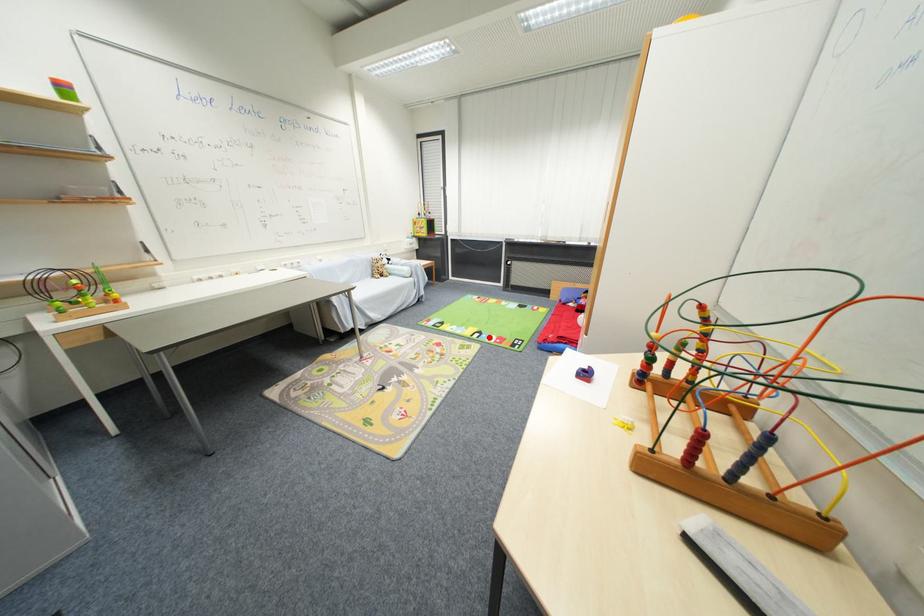
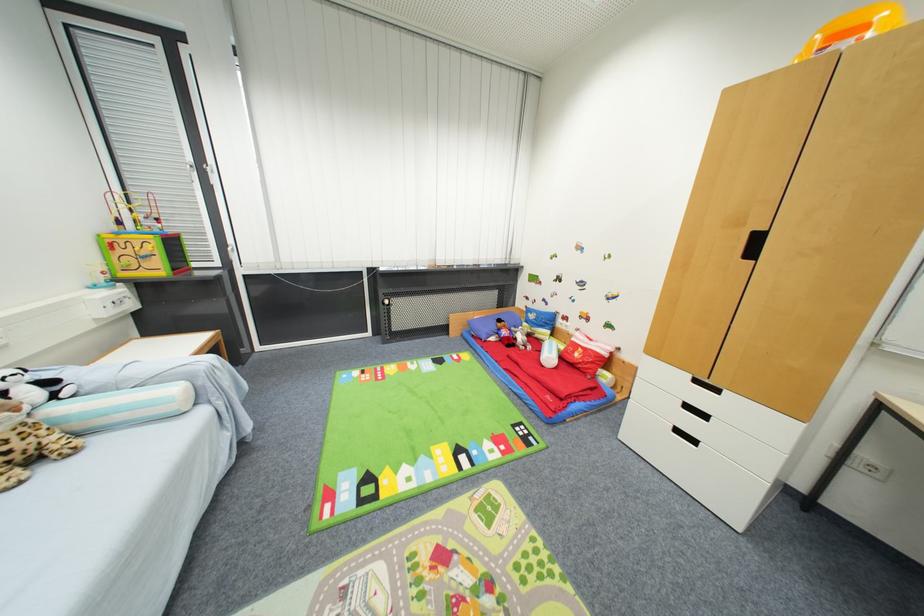
Question: I am providing you with two images of the same scene from different viewpoints. A red point is marked on the first image. Is the red point's position out of view in image 2?

Choices:
 (A) Yes
 (B) No

Answer: (B)